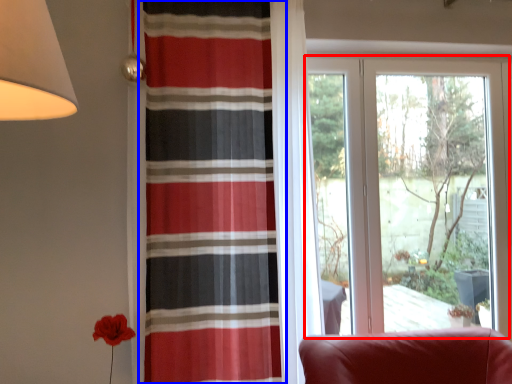
Question: Which of the following is the farthest to the observer, window (highlighted by a red box) or curtain (highlighted by a blue box)?

Choices:
 (A) window
 (B) curtain

Answer: (A)